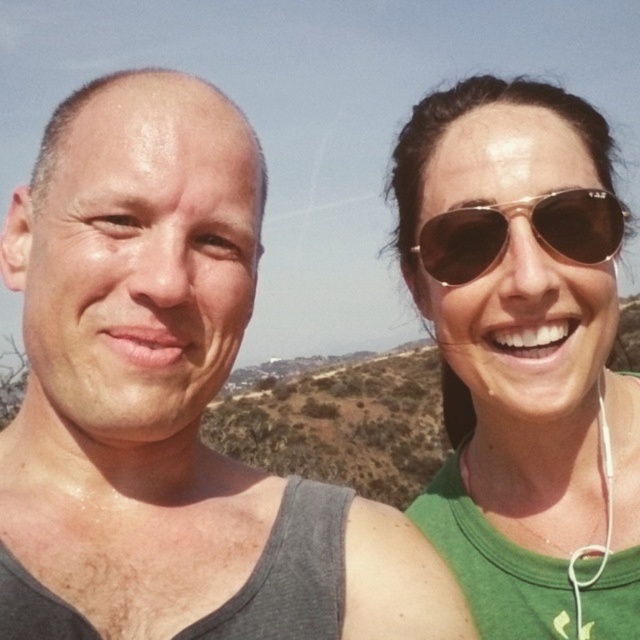
You are a photographer trying to capture a group photo of the gray tank top at left and the matte gold sunglasses at upper right. Since the photographer wants both subjects to be in the frame, which direction should you move the camera to ensure both are visible?

The gray tank top at left is to the left of the matte gold sunglasses at upper right, so moving the camera to the left would ensure both are visible in the frame.

You are a photographer trying to focus on the gray tank top at left and the brown reflective sunglasses at upper right in the image. Which object should you adjust your camera focus on first if you want to ensure both are in focus?

The gray tank top at left is positioned under brown reflective sunglasses at upper right, so you should focus on the gray tank top at left first to ensure both are in focus since it is closer to the camera.